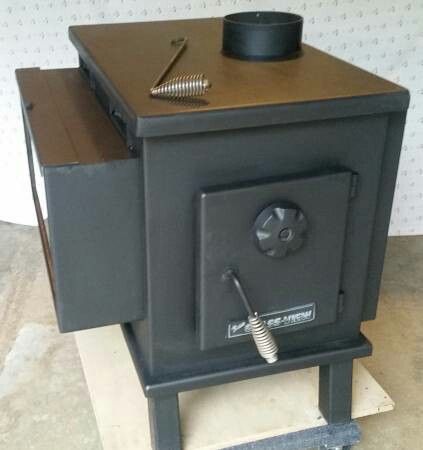
Find the location of a particular element. The height and width of the screenshot is (450, 423). floor is located at coordinates (405, 343).